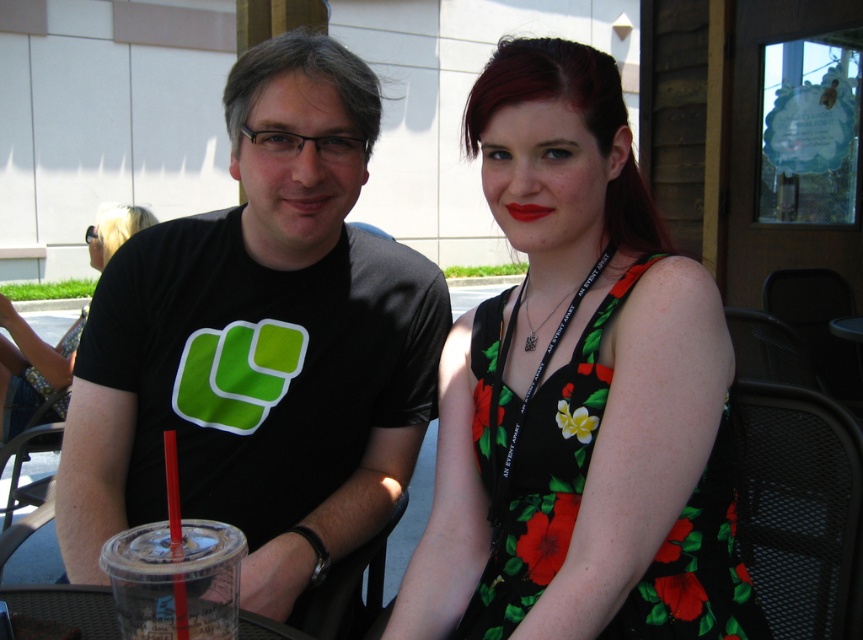
Does black matte t-shirt at center appear over clear plastic cup at lower center?

Yes, black matte t-shirt at center is above clear plastic cup at lower center.

Does black matte t-shirt at center have a greater width compared to clear plastic cup at lower center?

Yes, black matte t-shirt at center is wider than clear plastic cup at lower center.

Find the location of a particular element. The width and height of the screenshot is (863, 640). black matte t-shirt at center is located at coordinates (261, 344).

The image size is (863, 640). I want to click on black matte t-shirt at center, so (x=261, y=344).

Between point (683, 552) and point (61, 376), which one is positioned in front?

Point (683, 552)

This screenshot has height=640, width=863. In order to click on floral print fabric dress at center in this screenshot , I will do `click(533, 458)`.

Who is higher up, clear plastic cup at lower left or clear plastic cup at lower center?

Positioned higher is clear plastic cup at lower left.

Between point (199, 573) and point (28, 600), which one is positioned in front?

Positioned in front is point (199, 573).

Where is `clear plastic cup at lower left`? This screenshot has height=640, width=863. clear plastic cup at lower left is located at coordinates (175, 579).